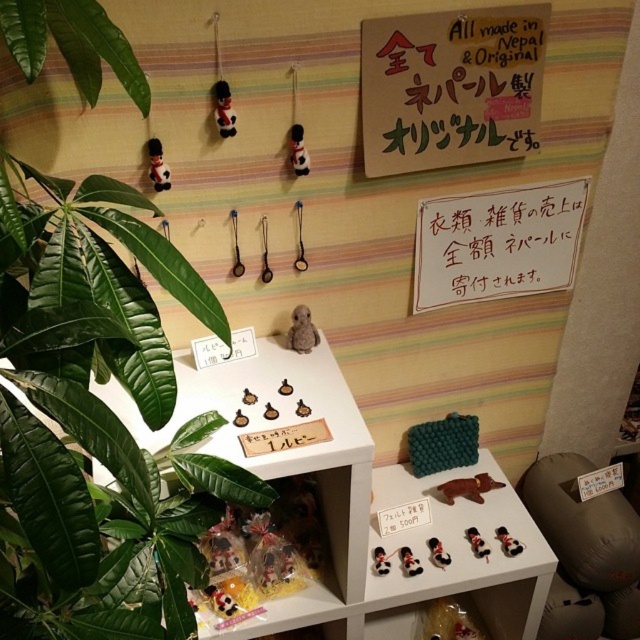
What is located at the point with coordinates (96, 420)?

The point at coordinates (96, 420) corresponds to a green leafy plant at left.

You are a delivery person who needs to place a new package between the green leafy plant at left and the brown cardboard sign at upper center. The package is 12 inches long. Is there enough space between them to fit the package?

The distance between the green leafy plant at left and the brown cardboard sign at upper center is 23.62 inches. Since the package is 12 inches long, there is enough space to fit it between them.

You are a customer at the display and want to pick up the black rubber hair tie at center and the black plush toy at center. Which item should you reach for first to grab the one closer to you?

The black rubber hair tie at center is closer to the viewer than the black plush toy at center, so you should reach for the black rubber hair tie at center first.